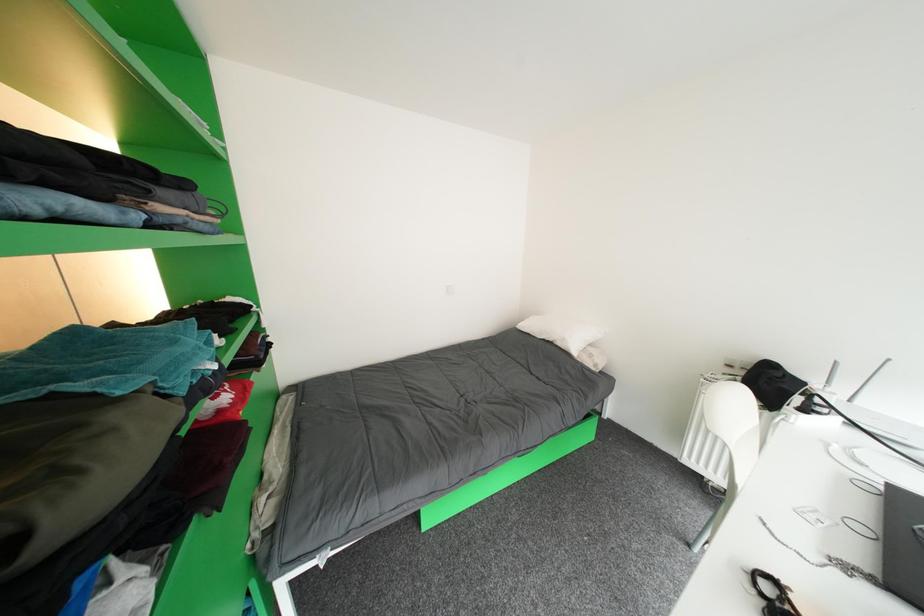
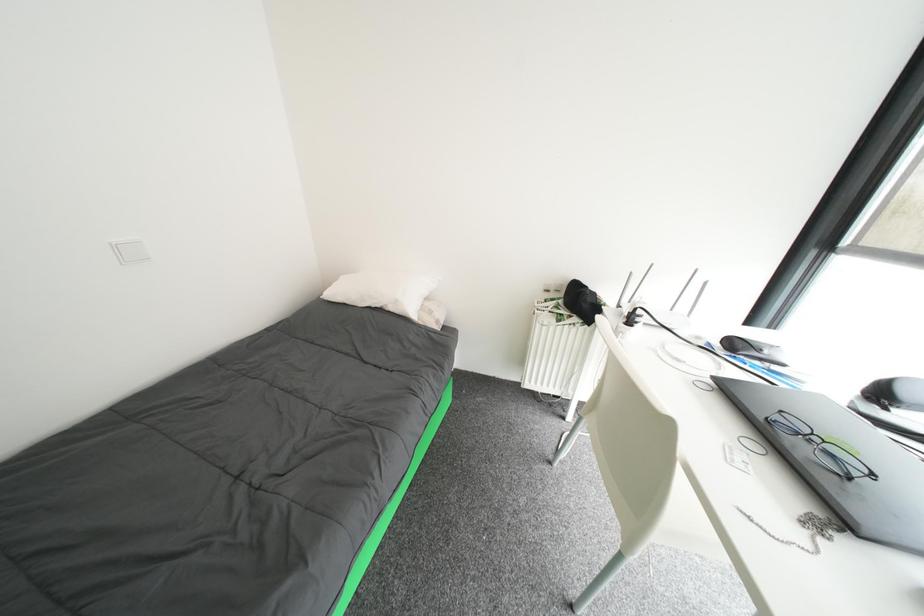
Question: The camera is either moving clockwise (left) or counter-clockwise (right) around the object. The first image is from the beginning of the video and the second image is from the end. Is the camera moving left or right when shooting the video?

Choices:
 (A) Left
 (B) Right

Answer: (A)